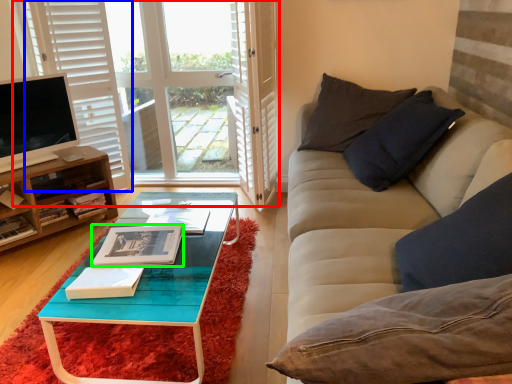
Question: Estimate the real-world distances between objects in this image. Which object is closer to window (highlighted by a red box), curtain (highlighted by a blue box) or book (highlighted by a green box)?

Choices:
 (A) curtain
 (B) book

Answer: (A)